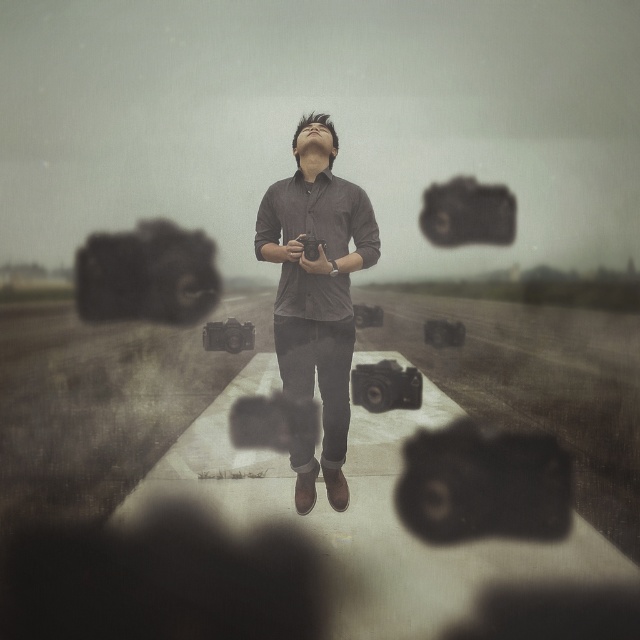
You are a photographer trying to capture the scene. You notice the matte gray shirt at center and the matte black camera at upper center. Which object is wider from your perspective?

The matte gray shirt at center is wider than the matte black camera at upper center.